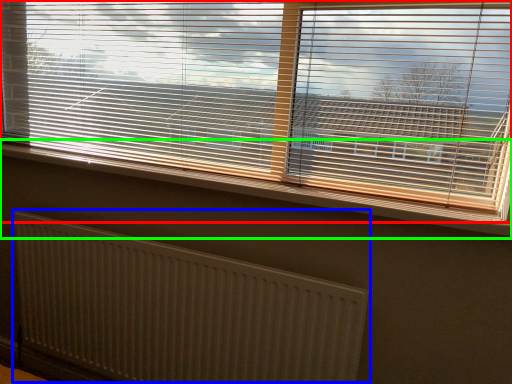
Question: Estimate the real-world distances between objects in this image. Which object is farther from window blind (highlighted by a red box), radiator (highlighted by a blue box) or window sill (highlighted by a green box)?

Choices:
 (A) radiator
 (B) window sill

Answer: (A)